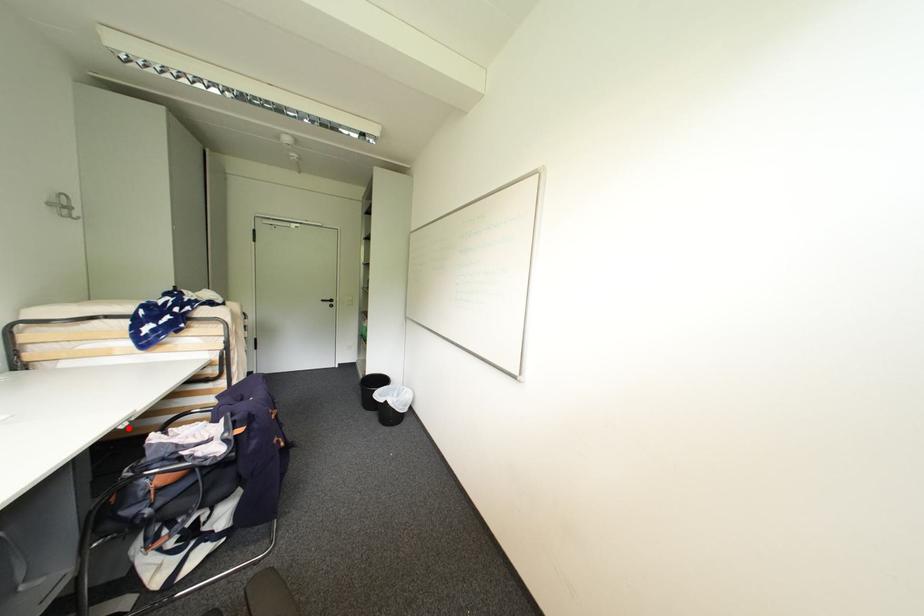
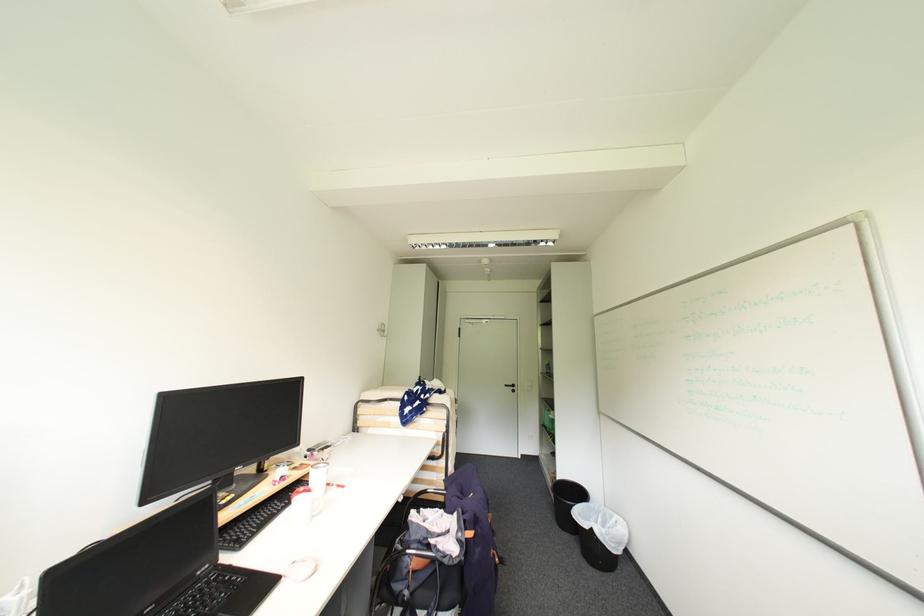
Where in the second image is the point corresponding to the highlighted location from the first image?

(407, 501)